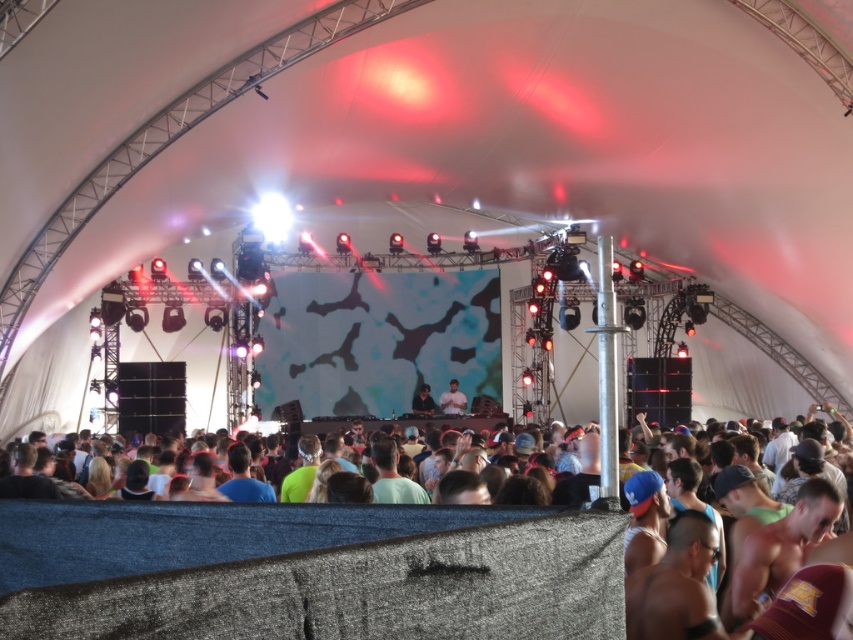
Question: Can you confirm if light beige fabric at center is wider than matte black dj booth at center?

Choices:
 (A) yes
 (B) no

Answer: (A)

Question: Which object is closer to the camera taking this photo?

Choices:
 (A) matte black dj booth at center
 (B) light beige fabric at center

Answer: (A)

Question: Can you confirm if light beige fabric at center is positioned to the left of matte black dj booth at center?

Choices:
 (A) yes
 (B) no

Answer: (B)

Question: Which point is farther to the camera?

Choices:
 (A) matte black dj booth at center
 (B) light beige fabric at center

Answer: (B)

Question: Which object is farther from the camera taking this photo?

Choices:
 (A) matte black dj booth at center
 (B) light beige fabric at center

Answer: (B)

Question: Does light beige fabric at center have a greater width compared to matte black dj booth at center?

Choices:
 (A) yes
 (B) no

Answer: (A)